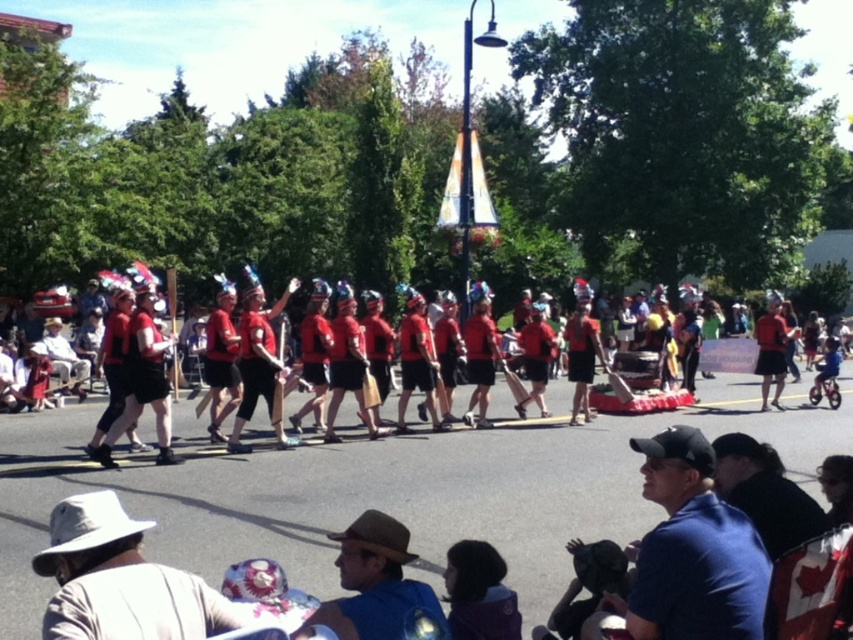
You are standing at the parade and see two points in the image. The first point is at coordinates point (x=816, y=452) and the second is at point (x=770, y=339). Which point is closer to you?

Point (x=816, y=452) is closer to the viewer than point (x=770, y=339).

You are a photographer at the event and want to capture a closeup of the blue cotton shirt at lower right and the matte red shorts at center. Which object should you zoom in on to get a clearer image without moving your camera?

The blue cotton shirt at lower right is thinner than the matte red shorts at center, so you should zoom in on the blue cotton shirt at lower right to get a clearer image without moving your camera because it has finer details.